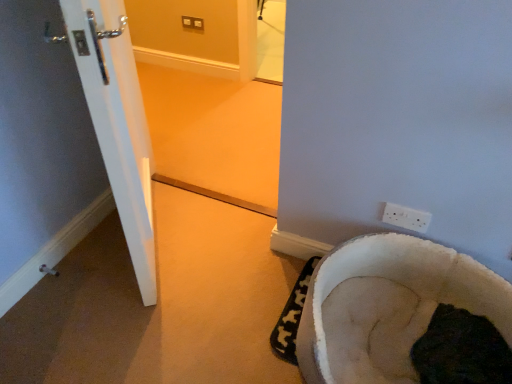
Where is `vacant region above white fluffy pet bed at lower right (from a real-world perspective)`? vacant region above white fluffy pet bed at lower right (from a real-world perspective) is located at coordinates (404, 319).